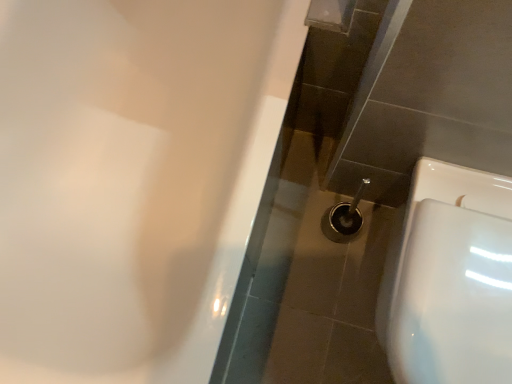
This screenshot has height=384, width=512. In order to click on white glossy bathtub at upper left in this screenshot , I will do `click(132, 178)`.

Describe the element at coordinates (132, 178) in the screenshot. I see `white glossy bathtub at upper left` at that location.

What do you see at coordinates (449, 279) in the screenshot? Image resolution: width=512 pixels, height=384 pixels. I see `white glossy toilet at lower right` at bounding box center [449, 279].

Locate an element on the screen. Image resolution: width=512 pixels, height=384 pixels. white glossy toilet at lower right is located at coordinates (449, 279).

I want to click on white glossy bathtub at upper left, so click(132, 178).

Between white glossy bathtub at upper left and white glossy toilet at lower right, which one appears on the right side from the viewer's perspective?

Positioned to the right is white glossy toilet at lower right.

Relative to white glossy toilet at lower right, is white glossy bathtub at upper left in front or behind?

Clearly, white glossy bathtub at upper left is in front of white glossy toilet at lower right.

Is point (140, 5) closer to viewer compared to point (490, 295)?

No.

From the image's perspective, is white glossy bathtub at upper left above white glossy toilet at lower right?

Yes, from the image's perspective, white glossy bathtub at upper left is over white glossy toilet at lower right.

From a real-world perspective, which object stands above the other?

In real-world perspective, white glossy bathtub at upper left is above.

Is white glossy bathtub at upper left wider than white glossy toilet at lower right?

Correct, the width of white glossy bathtub at upper left exceeds that of white glossy toilet at lower right.

Does white glossy bathtub at upper left have a lesser height compared to white glossy toilet at lower right?

No.

Is white glossy bathtub at upper left smaller than white glossy toilet at lower right?

No.

Is white glossy toilet at lower right completely or partially inside white glossy bathtub at upper left?

Definitely not — white glossy toilet at lower right is not inside white glossy bathtub at upper left.

Is white glossy bathtub at upper left not close to white glossy toilet at lower right?

white glossy bathtub at upper left is near white glossy toilet at lower right, not far away.

Is white glossy bathtub at upper left turned away from white glossy toilet at lower right?

No, white glossy bathtub at upper left is not facing away from white glossy toilet at lower right.

This screenshot has height=384, width=512. What are the coordinates of `bath above the white glossy toilet at lower right (from the image's perspective)` in the screenshot? It's located at (132, 178).

Which is more to the right, white glossy toilet at lower right or white glossy bathtub at upper left?

white glossy toilet at lower right is more to the right.

Is white glossy toilet at lower right behind white glossy bathtub at upper left?

Yes, white glossy toilet at lower right is further from the viewer.

Between point (460, 169) and point (229, 59), which one is positioned in front?

The point (460, 169) is closer.

From the image's perspective, which one is positioned higher, white glossy toilet at lower right or white glossy bathtub at upper left?

From the image's view, white glossy bathtub at upper left is above.

In the scene shown: From a real-world perspective, who is located higher, white glossy toilet at lower right or white glossy bathtub at upper left?

white glossy bathtub at upper left, from a real-world perspective.

Does white glossy toilet at lower right have a greater width compared to white glossy bathtub at upper left?

No.

Is white glossy toilet at lower right taller or shorter than white glossy bathtub at upper left?

Clearly, white glossy toilet at lower right is shorter compared to white glossy bathtub at upper left.

Between white glossy toilet at lower right and white glossy bathtub at upper left, which one has larger size?

With larger size is white glossy bathtub at upper left.

Would you say white glossy toilet at lower right is inside or outside white glossy bathtub at upper left?

white glossy toilet at lower right is not enclosed by white glossy bathtub at upper left.

Is white glossy toilet at lower right touching white glossy bathtub at upper left?

No, white glossy toilet at lower right is not next to white glossy bathtub at upper left.

In the scene shown: Is white glossy toilet at lower right oriented towards white glossy bathtub at upper left?

No, white glossy toilet at lower right is not aimed at white glossy bathtub at upper left.

What's the angular difference between white glossy toilet at lower right and white glossy bathtub at upper left's facing directions?

0.262 degrees separate the facing orientations of white glossy toilet at lower right and white glossy bathtub at upper left.

This screenshot has height=384, width=512. In order to click on toilet directly beneath the white glossy bathtub at upper left (from a real-world perspective) in this screenshot , I will do `click(449, 279)`.

Find the location of a particular element. bath above the white glossy toilet at lower right (from a real-world perspective) is located at coordinates (132, 178).

Find the location of a particular element. The height and width of the screenshot is (384, 512). bath above the white glossy toilet at lower right (from the image's perspective) is located at coordinates (132, 178).